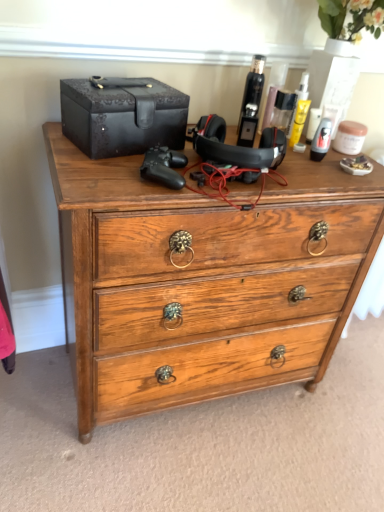
What do you see at coordinates (122, 115) in the screenshot?
I see `black leather box at upper left` at bounding box center [122, 115].

At what (x,y) coordinates should I click in order to perform the action: click on shiny black hair spray at upper center, which ranks as the 2th toiletry in right-to-left order. Please return your answer as a coordinate pair (x, y). Image resolution: width=384 pixels, height=512 pixels. Looking at the image, I should click on (252, 96).

At what (x,y) coordinates should I click in order to perform the action: click on wooden chest of drawers at center. Please return your answer as a coordinate pair (x, y). The width and height of the screenshot is (384, 512). Looking at the image, I should click on (204, 279).

This screenshot has width=384, height=512. What are the coordinates of `the 1st toiletry to the right of the wooden chest of drawers at center, counting from the anchor's position` in the screenshot? It's located at (252, 96).

In terms of width, does wooden chest of drawers at center look wider or thinner when compared to shiny black hair spray at upper center, the first toiletry from the left?

wooden chest of drawers at center is wider than shiny black hair spray at upper center, the first toiletry from the left.

From a real-world perspective, is wooden chest of drawers at center physically located above or below shiny black hair spray at upper center, which ranks as the 2th toiletry in right-to-left order?

wooden chest of drawers at center is below shiny black hair spray at upper center, which ranks as the 2th toiletry in right-to-left order.

From the picture: Between wooden chest of drawers at center and shiny black hair spray at upper center, which ranks as the 2th toiletry in right-to-left order, which one appears on the left side from the viewer's perspective?

wooden chest of drawers at center is more to the left.

Is shiny black bottle at upper right, which is the 1th toiletry from right to left, at the back of black leather box at upper left?

black leather box at upper left is not turned away from shiny black bottle at upper right, which is the 1th toiletry from right to left.

Measure the distance between black leather box at upper left and shiny black bottle at upper right, which is the 1th toiletry from right to left.

They are 20.41 inches apart.

Is shiny black bottle at upper right, which is the 1th toiletry from right to left, a part of black leather box at upper left?

Definitely not — shiny black bottle at upper right, which is the 1th toiletry from right to left, is not inside black leather box at upper left.

Locate an element on the screen. Image resolution: width=384 pixels, height=512 pixels. storage box to the left of shiny black bottle at upper right, the 2th toiletry positioned from the left is located at coordinates (122, 115).

From a real-world perspective, who is located lower, shiny black hair spray at upper center, the first toiletry from the left, or wooden chest of drawers at center?

wooden chest of drawers at center.

Is shiny black hair spray at upper center, which ranks as the 2th toiletry in right-to-left order, looking in the opposite direction of wooden chest of drawers at center?

No, shiny black hair spray at upper center, which ranks as the 2th toiletry in right-to-left order, is not facing away from wooden chest of drawers at center.

Locate an element on the screen. Image resolution: width=384 pixels, height=512 pixels. the chest of drawers below the shiny black hair spray at upper center, the first toiletry from the left (from a real-world perspective) is located at coordinates (204, 279).

Is the surface of shiny black hair spray at upper center, the first toiletry from the left, in direct contact with wooden chest of drawers at center?

No, shiny black hair spray at upper center, the first toiletry from the left, is not next to wooden chest of drawers at center.

Does point (107, 153) come closer to viewer compared to point (101, 254)?

No, (107, 153) is behind (101, 254).

Is black leather box at upper left looking in the opposite direction of wooden chest of drawers at center?

No.

Between black leather box at upper left and wooden chest of drawers at center, which one has smaller size?

With smaller size is black leather box at upper left.

Is shiny black hair spray at upper center, the first toiletry from the left, behind black leather box at upper left?

Yes, shiny black hair spray at upper center, the first toiletry from the left, is further from the viewer.

In the scene shown: Are shiny black hair spray at upper center, which ranks as the 2th toiletry in right-to-left order, and black leather box at upper left beside each other?

No.

There is a black leather box at upper left. What are the coordinates of `the 1st toiletry above it (from the image's perspective)` in the screenshot? It's located at (252, 96).

Could you tell me if shiny black hair spray at upper center, the first toiletry from the left, is turned towards black leather box at upper left?

No, shiny black hair spray at upper center, the first toiletry from the left, is not facing towards black leather box at upper left.

Can you confirm if wooden chest of drawers at center is thinner than shiny black bottle at upper right, the 2th toiletry positioned from the left?

No, wooden chest of drawers at center is not thinner than shiny black bottle at upper right, the 2th toiletry positioned from the left.

In the scene shown: From the image's perspective, does wooden chest of drawers at center appear lower than shiny black bottle at upper right, which is the 1th toiletry from right to left?

Yes, from the image's perspective, wooden chest of drawers at center is below shiny black bottle at upper right, which is the 1th toiletry from right to left.

Is wooden chest of drawers at center oriented towards shiny black bottle at upper right, which is the 1th toiletry from right to left?

No, wooden chest of drawers at center does not turn towards shiny black bottle at upper right, which is the 1th toiletry from right to left.

Considering the points (262, 123) and (252, 89), which point is behind, point (262, 123) or point (252, 89)?

The point (262, 123) is behind.

From the image's perspective, which one is positioned lower, shiny black bottle at upper right, which is the 1th toiletry from right to left, or shiny black hair spray at upper center, which ranks as the 2th toiletry in right-to-left order?

From the image's view, shiny black hair spray at upper center, which ranks as the 2th toiletry in right-to-left order, is below.

Does shiny black bottle at upper right, which is the 1th toiletry from right to left, have a greater height compared to shiny black hair spray at upper center, the first toiletry from the left?

In fact, shiny black bottle at upper right, which is the 1th toiletry from right to left, may be shorter than shiny black hair spray at upper center, the first toiletry from the left.

From a real-world perspective, which toiletry is the 1st one above the wooden chest of drawers at center? Please provide its 2D coordinates.

[(252, 96)]

Image resolution: width=384 pixels, height=512 pixels. Identify the location of storage box that is under the shiny black bottle at upper right, which is the 1th toiletry from right to left (from a real-world perspective). (122, 115).

Based on the photo, when comparing their distances from shiny black hair spray at upper center, the first toiletry from the left, does black leather box at upper left or shiny black bottle at upper right, the 2th toiletry positioned from the left, seem closer?

shiny black bottle at upper right, the 2th toiletry positioned from the left.

Based on their spatial positions, is shiny black hair spray at upper center, the first toiletry from the left, or shiny black bottle at upper right, the 2th toiletry positioned from the left, further from wooden chest of drawers at center?

The object further to wooden chest of drawers at center is shiny black bottle at upper right, the 2th toiletry positioned from the left.

From the image, which object appears to be nearer to shiny black bottle at upper right, which is the 1th toiletry from right to left, black leather box at upper left or wooden chest of drawers at center?

black leather box at upper left.

Based on their spatial positions, is shiny black bottle at upper right, the 2th toiletry positioned from the left, or black leather box at upper left further from shiny black hair spray at upper center, which ranks as the 2th toiletry in right-to-left order?

Among the two, black leather box at upper left is located further to shiny black hair spray at upper center, which ranks as the 2th toiletry in right-to-left order.

Looking at the image, which one is located closer to wooden chest of drawers at center, black leather box at upper left or shiny black hair spray at upper center, the first toiletry from the left?

The object closer to wooden chest of drawers at center is black leather box at upper left.

From the image, which object appears to be farther from black leather box at upper left, wooden chest of drawers at center or shiny black bottle at upper right, the 2th toiletry positioned from the left?

shiny black bottle at upper right, the 2th toiletry positioned from the left, lies further to black leather box at upper left than the other object.

Considering their positions, is shiny black bottle at upper right, which is the 1th toiletry from right to left, positioned further to black leather box at upper left than shiny black hair spray at upper center, which ranks as the 2th toiletry in right-to-left order?

The object further to black leather box at upper left is shiny black bottle at upper right, which is the 1th toiletry from right to left.

When comparing their distances from shiny black bottle at upper right, which is the 1th toiletry from right to left, does wooden chest of drawers at center or black leather box at upper left seem further?

The object further to shiny black bottle at upper right, which is the 1th toiletry from right to left, is wooden chest of drawers at center.

Where is `toiletry between black leather box at upper left and shiny black bottle at upper right, which is the 1th toiletry from right to left`? The width and height of the screenshot is (384, 512). toiletry between black leather box at upper left and shiny black bottle at upper right, which is the 1th toiletry from right to left is located at coordinates click(x=252, y=96).

Find the location of `storage box between shiny black bottle at upper right, the 2th toiletry positioned from the left, and wooden chest of drawers at center, in the vertical direction`. storage box between shiny black bottle at upper right, the 2th toiletry positioned from the left, and wooden chest of drawers at center, in the vertical direction is located at coordinates (122, 115).

Locate an element on the screen. toiletry between shiny black bottle at upper right, the 2th toiletry positioned from the left, and wooden chest of drawers at center, in the vertical direction is located at coordinates (252, 96).

This screenshot has width=384, height=512. What are the coordinates of `storage box between shiny black hair spray at upper center, which ranks as the 2th toiletry in right-to-left order, and wooden chest of drawers at center vertically` in the screenshot? It's located at (122, 115).